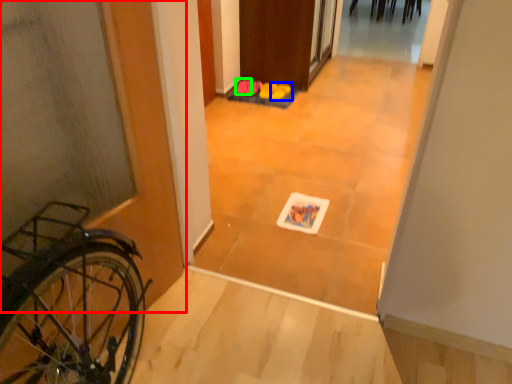
Question: Estimate the real-world distances between objects in this image. Which object is closer to door (highlighted by a red box), footwear (highlighted by a blue box) or footwear (highlighted by a green box)?

Choices:
 (A) footwear
 (B) footwear

Answer: (A)